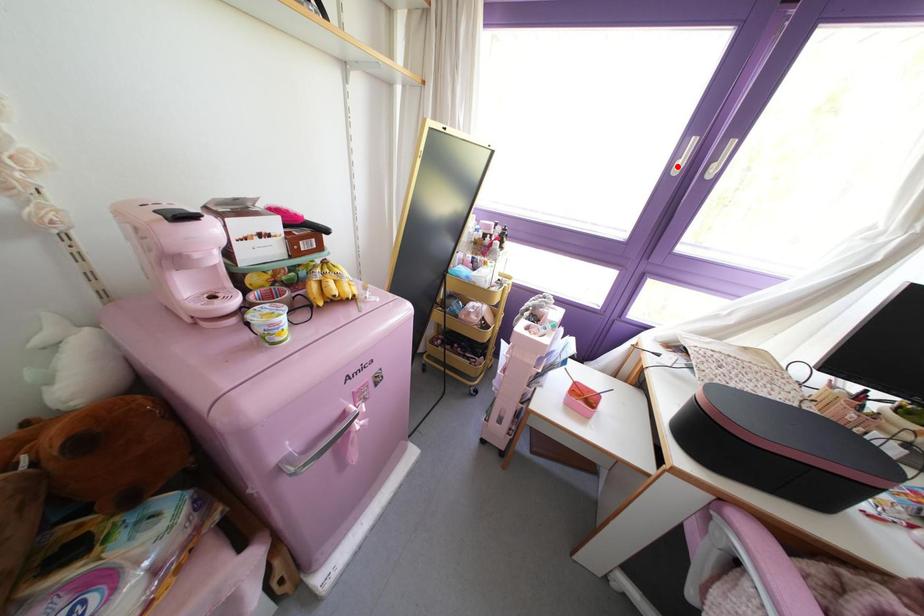
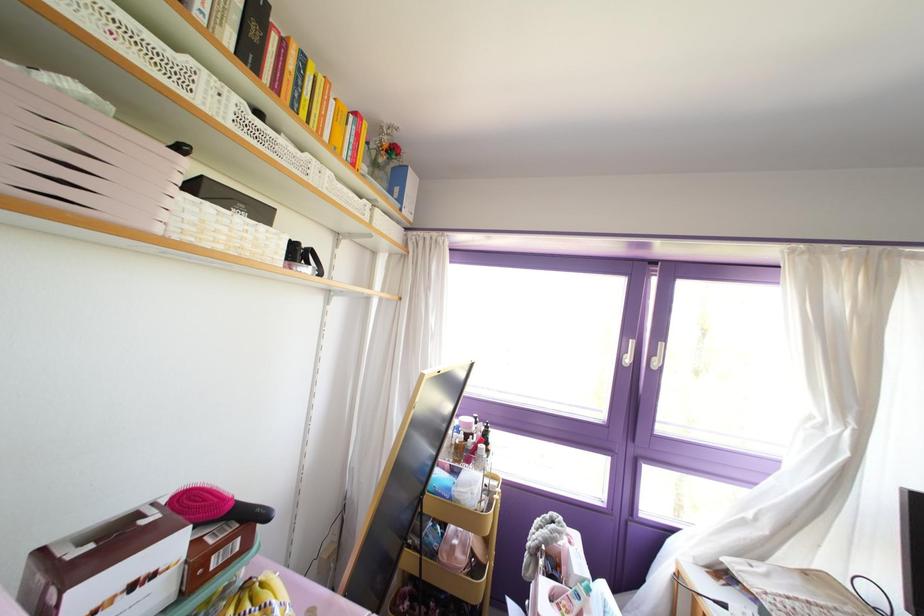
In the second image, find the point that corresponds to the highlighted location in the first image.

(626, 360)